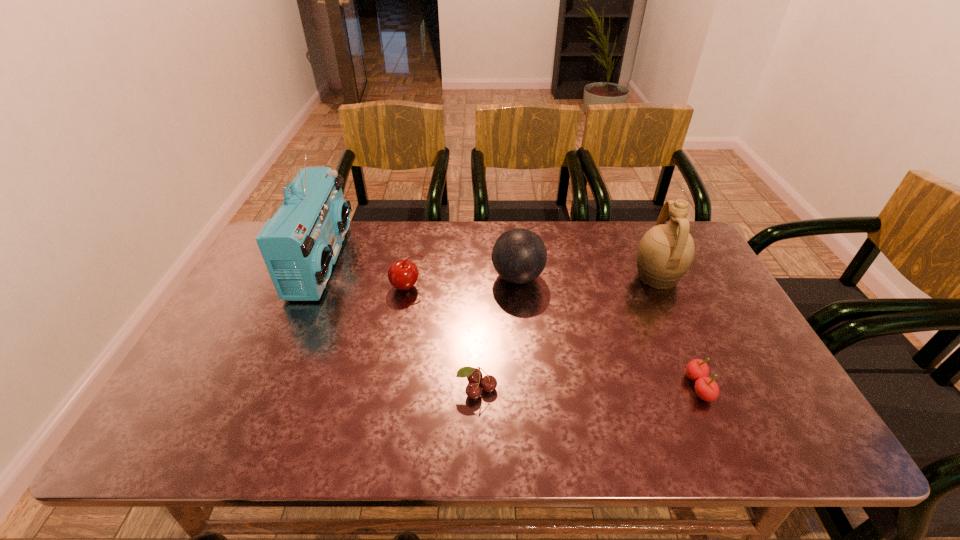
Select which cherry appears as the second closest to the tallest cherry. Please provide its 2D coordinates. Your answer should be formatted as a tuple, i.e. [(x, y)], where the tuple contains the x and y coordinates of a point satisfying the conditions above.

[(707, 389)]

Locate an element on the screen. vacant area that satisfies the following two spatial constraints: 1. on the back side of the second tallest object; 2. on the right side of the rightmost cherry is located at coordinates (650, 277).

You are a GUI agent. You are given a task and a screenshot of the screen. Output one action in this format:
    pyautogui.click(x=<x>, y=<y>)
    Task: Click on the vacant space that satisfies the following two spatial constraints: 1. on the grip area of the pitcher; 2. on the left side of the fourth shortest object
    
    Given the screenshot: What is the action you would take?
    pyautogui.click(x=517, y=277)

At what (x,y) coordinates should I click in order to perform the action: click on blank area in the image that satisfies the following two spatial constraints: 1. on the grip area of the fourth shortest object; 2. on the back side of the pitcher. Please return your answer as a coordinate pair (x, y). The height and width of the screenshot is (540, 960). Looking at the image, I should click on (517, 277).

Locate an element on the screen. free spot that satisfies the following two spatial constraints: 1. on the grip area of the rightmost cherry; 2. on the left side of the bowling ball is located at coordinates (528, 387).

Where is `vacant space that satisfies the following two spatial constraints: 1. on the grip area of the fourth shortest object; 2. on the left side of the rightmost cherry`? The width and height of the screenshot is (960, 540). vacant space that satisfies the following two spatial constraints: 1. on the grip area of the fourth shortest object; 2. on the left side of the rightmost cherry is located at coordinates (528, 387).

The image size is (960, 540). In order to click on vacant space that satisfies the following two spatial constraints: 1. on the grip area of the bowling ball; 2. on the leaves of the second cherry from left to right in this screenshot , I will do `click(529, 388)`.

At what (x,y) coordinates should I click in order to perform the action: click on free point that satisfies the following two spatial constraints: 1. on the grip area of the fourth shortest object; 2. on the leaves of the second cherry from left to right. Please return your answer as a coordinate pair (x, y). The image size is (960, 540). Looking at the image, I should click on (529, 388).